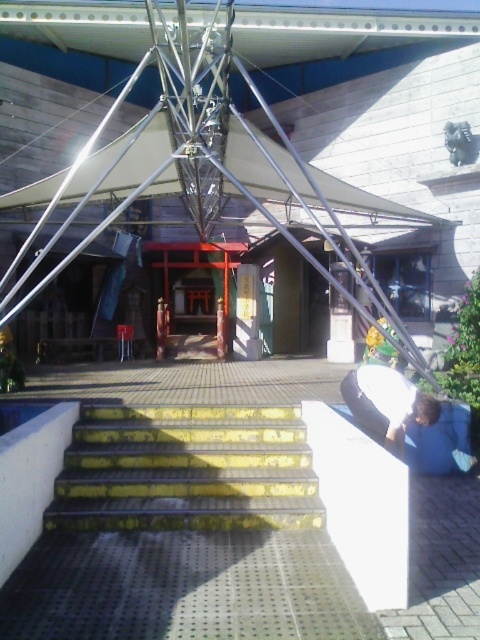
You are standing at the entrance of the shrine and want to place a small offering. You have two points marked as potential spots. The first is point (90, 429) and the second is point (369, 384). Which point is closer to you where you can easily reach to place the offering?

Point (90, 429) is closer to you than point (369, 384), so you can easily reach it to place the offering.